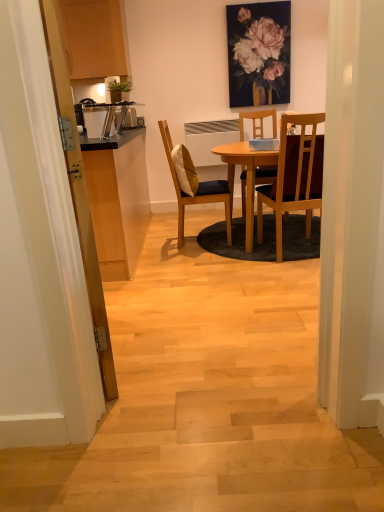
Question: Considering their positions, is wooden chair at center, the second chair from the left, located in front of or behind transparent wooden door at left?

Choices:
 (A) behind
 (B) front

Answer: (A)

Question: From the image's perspective, is wooden chair at center, the second chair from the left, positioned above or below transparent wooden door at left?

Choices:
 (A) below
 (B) above

Answer: (B)

Question: Which of these objects is positioned farthest from the matte floral painting at upper center?

Choices:
 (A) wooden chair at center, the second chair from the left
 (B) transparent wooden door at left
 (C) yellow fabric pillow at center
 (D) wooden chair with cushion at center, the first chair from the left

Answer: (B)

Question: Which of these objects is positioned farthest from the wooden chair at center, the second chair from the left?

Choices:
 (A) wooden chair with cushion at center, the second chair in the right-to-left sequence
 (B) transparent wooden door at left
 (C) yellow fabric pillow at center
 (D) matte floral painting at upper center

Answer: (D)